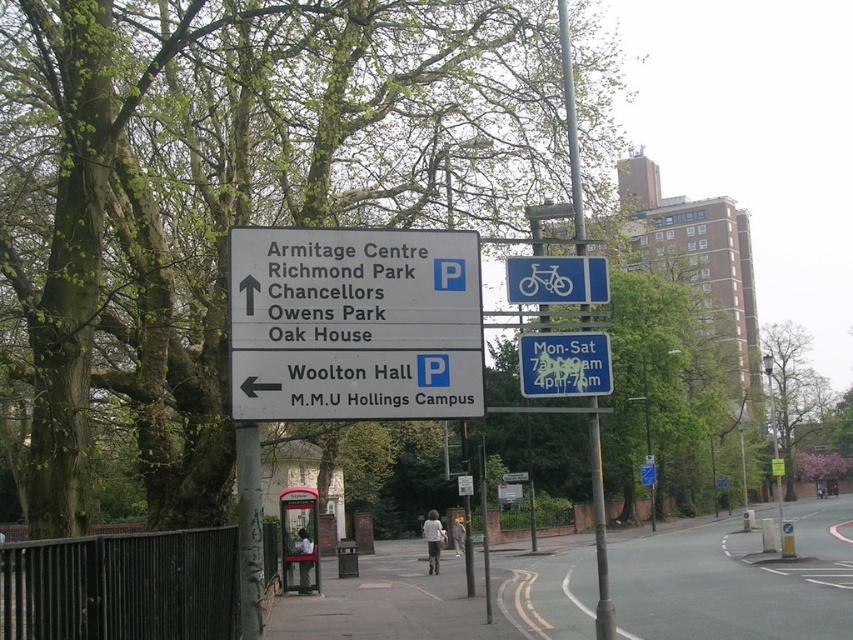
Question: Is white plastic sign at center behind blue plastic bicycle at upper center?

Choices:
 (A) no
 (B) yes

Answer: (A)

Question: Is blue plastic sign at upper center thinner than red painted metal bus stop at center?

Choices:
 (A) no
 (B) yes

Answer: (B)

Question: Can you confirm if white plastic sign at center is wider than metallic gray phone box at center?

Choices:
 (A) yes
 (B) no

Answer: (A)

Question: Which object appears farthest from the camera in this image?

Choices:
 (A) blue metallic signpost at upper center
 (B) blue plastic sign at upper center

Answer: (A)

Question: Estimate the real-world distances between objects in this image. Which object is farther from the blue plastic bicycle at upper center?

Choices:
 (A) gray asphalt road at lower center
 (B) blue metallic signpost at upper center

Answer: (A)

Question: Which object is farther from the camera taking this photo?

Choices:
 (A) blue plastic bicycle at upper center
 (B) blue metallic signpost at upper center

Answer: (A)